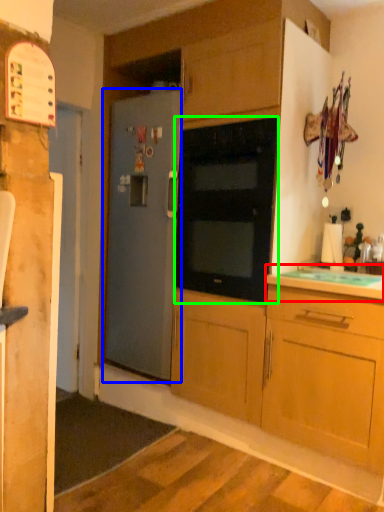
Question: Which is farther away from countertop (highlighted by a red box)? refrigerator (highlighted by a blue box) or oven (highlighted by a green box)?

Choices:
 (A) refrigerator
 (B) oven

Answer: (A)